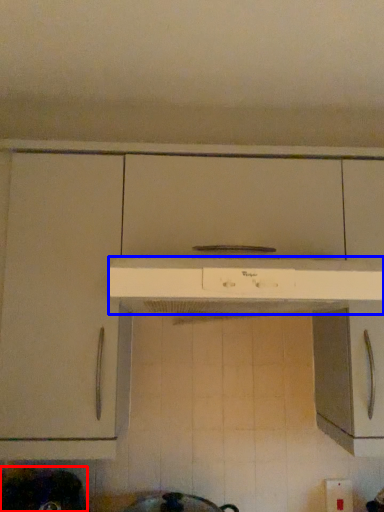
Question: Which object is closer to the camera taking this photo, appliance (highlighted by a red box) or home appliance (highlighted by a blue box)?

Choices:
 (A) appliance
 (B) home appliance

Answer: (B)